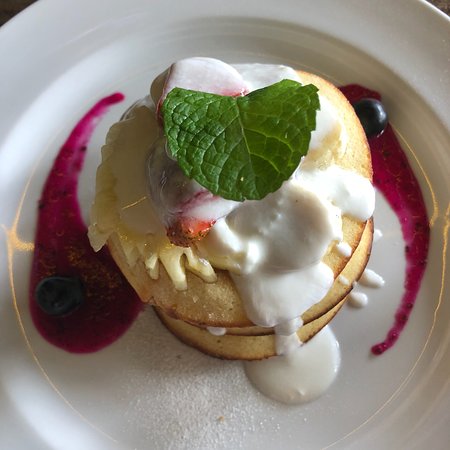
Locate an element on the screen. table in the background is located at coordinates (445, 8), (7, 9).